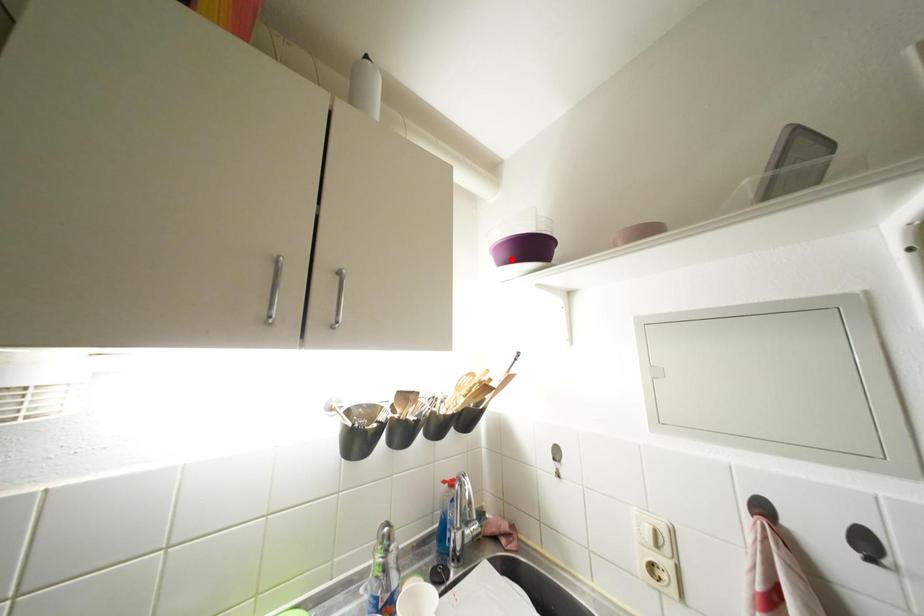
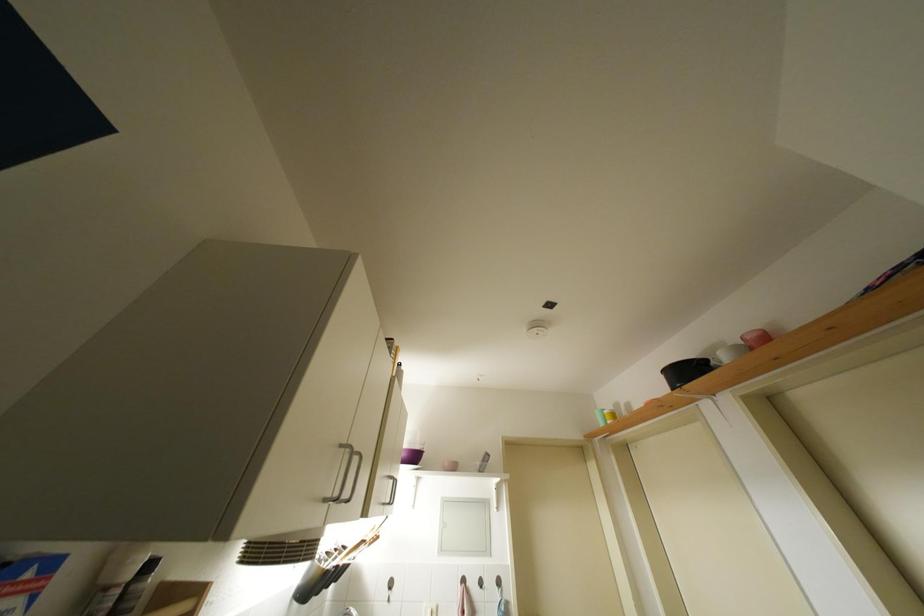
Where in the second image is the point corresponding to the highlighted location from the first image?

(410, 459)